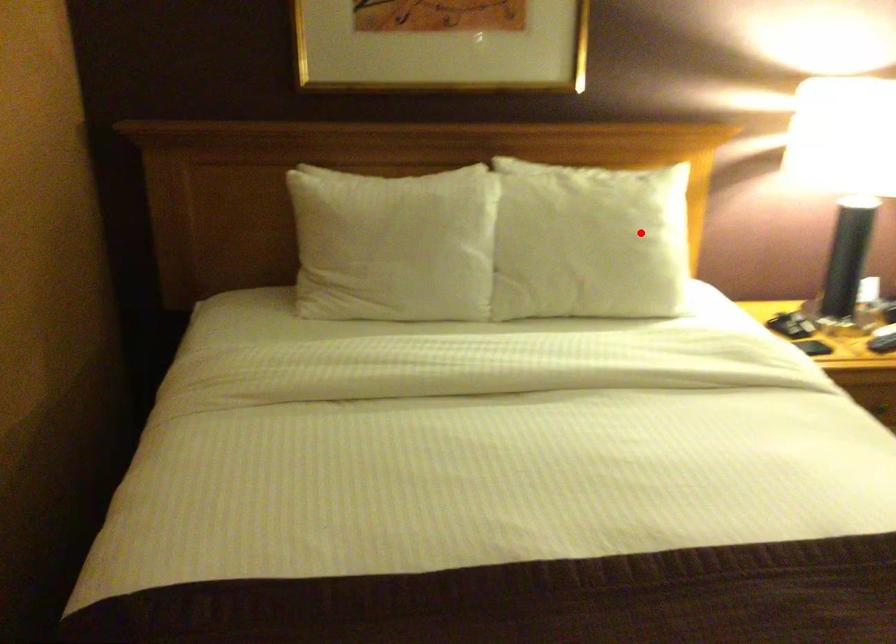
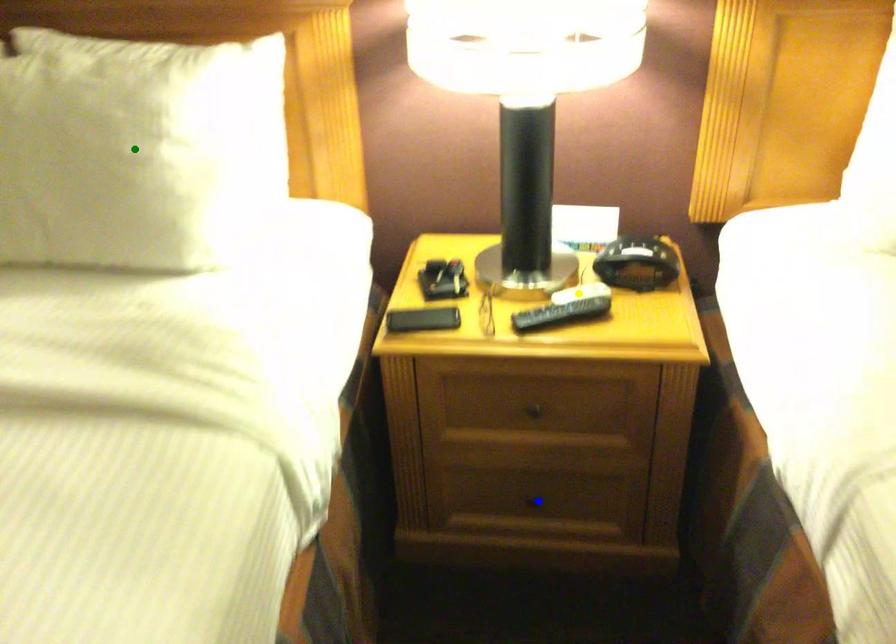
Question: I am providing you with two images of the same scene from different viewpoints. A red point is marked on the first image. You are given multiple points on the second image. Can you choose the point in image 2 that corresponds to the point in image 1?

Choices:
 (A) yellow point
 (B) blue point
 (C) green point

Answer: (C)